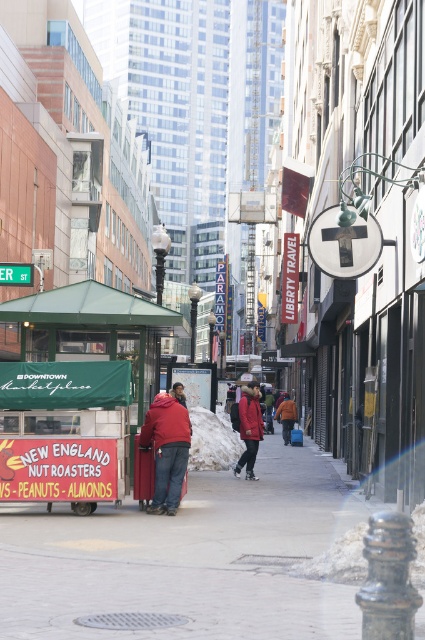
You are a delivery person who needs to place a small package on the brick pavement at center. However, there is a red woolen hat at center in the way. Can you easily move the hat to make space?

The brick pavement at center is larger in size than the red woolen hat at center, so yes, there is enough space to move the hat and place the package on the brick pavement at center.

You are a delivery person trying to navigate through the street. You see a green fabric cart at center and a red woolen hat at center. Which object is higher up from the ground?

The green fabric cart at center is above the red woolen hat at center, so the green fabric cart at center is higher up from the ground.